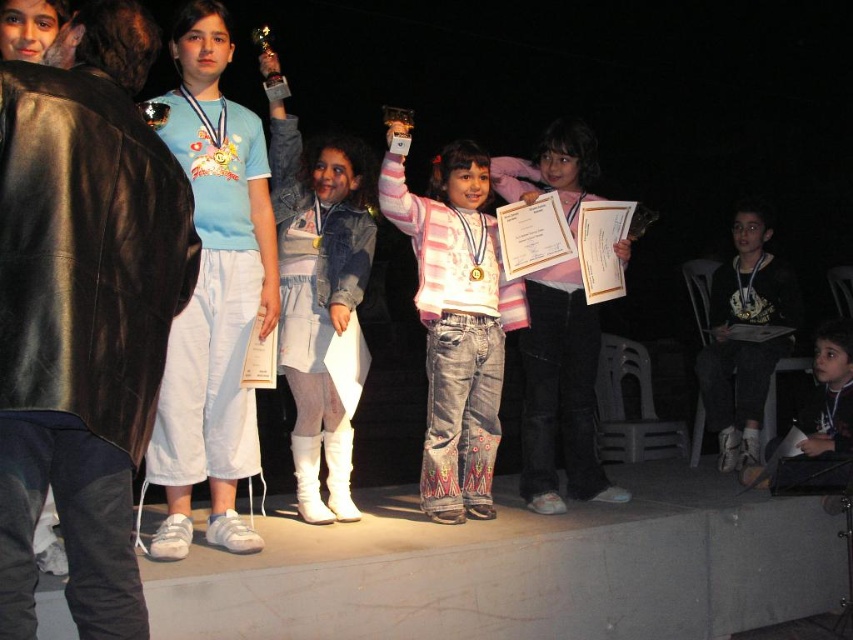
You are an event planner setting up a camera to capture the children on stage. The camera is positioned to focus on the pink striped sweater at center. What are the coordinates where the camera should be aimed?

The camera should be aimed at the coordinates point (x=456, y=324) where the pink striped sweater at center is located.

You are a photographer trying to capture a candid shot of the children on stage. You notice the white leather boots at center and the black leather jacket at lower right. Which object is positioned more to the left side of the stage?

The white leather boots at center are positioned to the left of the black leather jacket at lower right, so the white leather boots at center are more to the left.

You are a photographer positioned behind the stage. You need to capture a closeup shot of both the white leather boots at center and the pink striped sweater at center. Given their sizes, which object should you focus on first to ensure it fits in the frame without cropping?

The white leather boots at center has a lesser width compared to the pink striped sweater at center, so you should focus on capturing the pink striped sweater at center first since it is wider and requires more space in the frame.